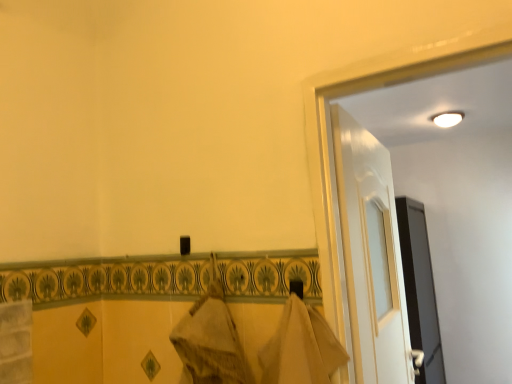
Question: In the image, is white glossy door at upper right positioned in front of or behind white glossy light at upper right?

Choices:
 (A) front
 (B) behind

Answer: (A)

Question: From the image's perspective, is white glossy door at upper right positioned above or below white glossy light at upper right?

Choices:
 (A) below
 (B) above

Answer: (A)

Question: Considering the real-world distances, which object is closest to the white glossy light at upper right?

Choices:
 (A) white glossy door at upper right
 (B) black glossy screen door at right

Answer: (B)

Question: Considering the real-world distances, which object is farthest from the white glossy light at upper right?

Choices:
 (A) black glossy screen door at right
 (B) white glossy door at upper right

Answer: (B)